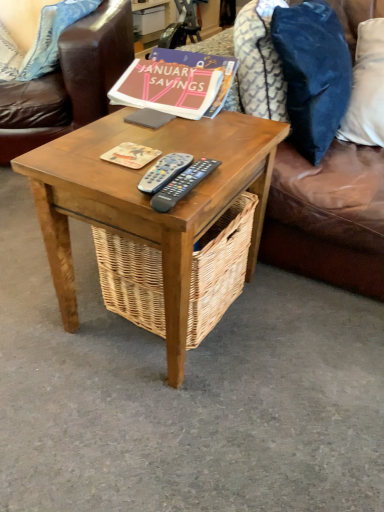
This screenshot has width=384, height=512. Find the location of `empty space that is to the right of matte cardboard coaster at center, the 2th book from the back`. empty space that is to the right of matte cardboard coaster at center, the 2th book from the back is located at coordinates (212, 146).